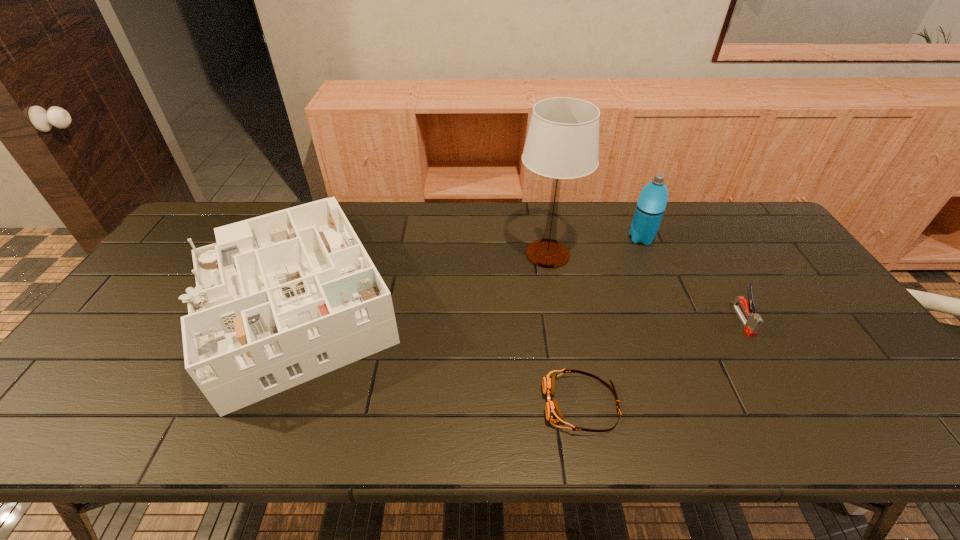
You are a GUI agent. You are given a task and a screenshot of the screen. Output one action in this format:
    pyautogui.click(x=<x>, y=<y>)
    Task: Click on the free space that satisfies the following two spatial constraints: 1. on the handle side of the rightmost object; 2. with the lenses facing forward on the shortest object
    This screenshot has height=540, width=960.
    Given the screenshot: What is the action you would take?
    pyautogui.click(x=790, y=404)